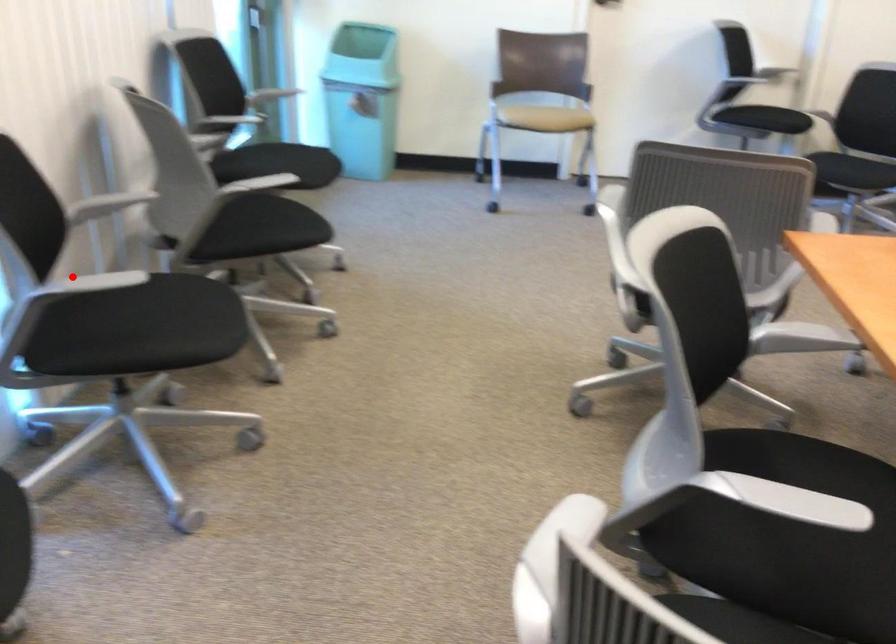
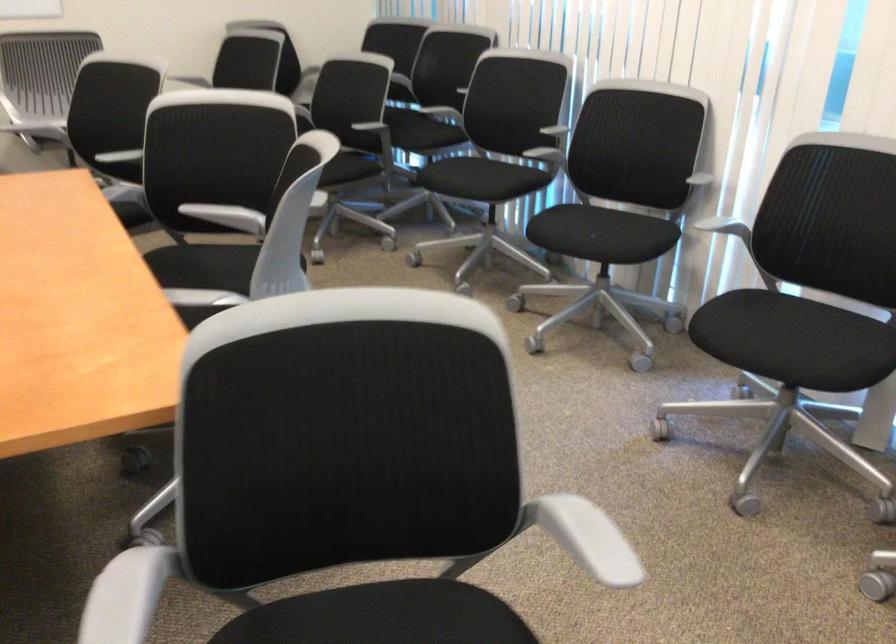
Where in the second image is the point corresponding to the highlighted location from the first image?

(725, 228)